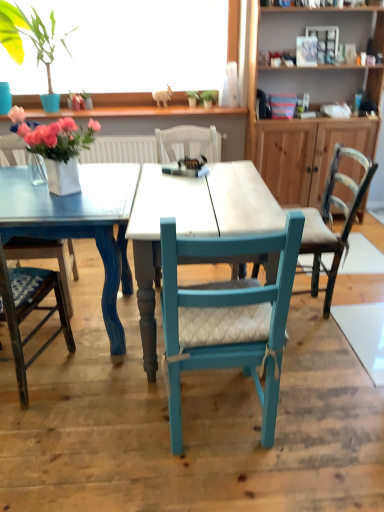
Question: Considering the relative sizes of white wood table at center and blue fabric cushioned chair at left, marked as the third chair in a right-to-left arrangement, in the image provided, is white wood table at center bigger than blue fabric cushioned chair at left, marked as the third chair in a right-to-left arrangement,?

Choices:
 (A) no
 (B) yes

Answer: (B)

Question: Can you confirm if white wood table at center is shorter than blue fabric cushioned chair at left, marked as the third chair in a right-to-left arrangement?

Choices:
 (A) no
 (B) yes

Answer: (B)

Question: Considering the relative sizes of white wood table at center and blue fabric cushioned chair at left, arranged as the 2th chair when viewed from the left, in the image provided, is white wood table at center wider than blue fabric cushioned chair at left, arranged as the 2th chair when viewed from the left,?

Choices:
 (A) no
 (B) yes

Answer: (B)

Question: Does white wood table at center turn towards blue fabric cushioned chair at left, marked as the third chair in a right-to-left arrangement?

Choices:
 (A) no
 (B) yes

Answer: (A)

Question: From the image's perspective, is white wood table at center under blue fabric cushioned chair at left, arranged as the 2th chair when viewed from the left?

Choices:
 (A) no
 (B) yes

Answer: (A)

Question: Considering the relative positions of white wood table at center and blue fabric cushioned chair at left, arranged as the 2th chair when viewed from the left, in the image provided, is white wood table at center in front of blue fabric cushioned chair at left, arranged as the 2th chair when viewed from the left,?

Choices:
 (A) yes
 (B) no

Answer: (B)

Question: From a real-world perspective, is matte pink flowers at left positioned under wooden cabinet at upper right based on gravity?

Choices:
 (A) no
 (B) yes

Answer: (A)

Question: Does matte pink flowers at left appear on the left side of wooden cabinet at upper right?

Choices:
 (A) yes
 (B) no

Answer: (A)

Question: Is matte pink flowers at left thinner than wooden cabinet at upper right?

Choices:
 (A) no
 (B) yes

Answer: (B)

Question: Can wooden cabinet at upper right be found inside matte pink flowers at left?

Choices:
 (A) no
 (B) yes

Answer: (A)

Question: From the image's perspective, would you say matte pink flowers at left is positioned over wooden cabinet at upper right?

Choices:
 (A) no
 (B) yes

Answer: (A)

Question: From a real-world perspective, is matte pink flowers at left located higher than wooden cabinet at upper right?

Choices:
 (A) no
 (B) yes

Answer: (B)

Question: From a real-world perspective, is matte pink flowers at left located higher than blue fabric cushioned chair at left, marked as the third chair in a right-to-left arrangement?

Choices:
 (A) yes
 (B) no

Answer: (A)